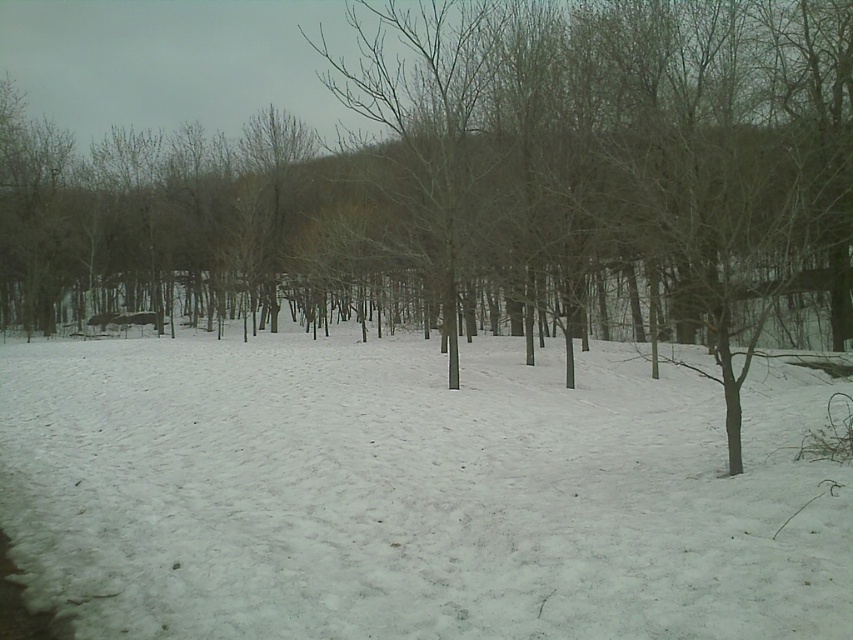
What do you see at coordinates (413, 493) in the screenshot? The width and height of the screenshot is (853, 640). I see `white fluffy snow at center` at bounding box center [413, 493].

Does point (345, 593) come closer to viewer compared to point (368, 280)?

Yes, point (345, 593) is in front of point (368, 280).

This screenshot has width=853, height=640. What are the coordinates of `white fluffy snow at center` in the screenshot? It's located at [413, 493].